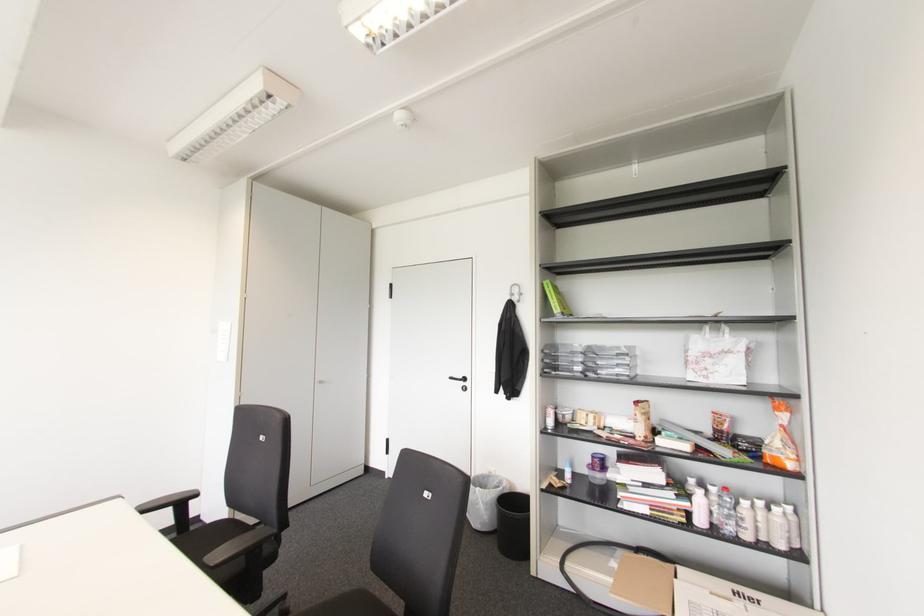
What do you see at coordinates (157, 503) in the screenshot? The image size is (924, 616). I see `the black chair armrest` at bounding box center [157, 503].